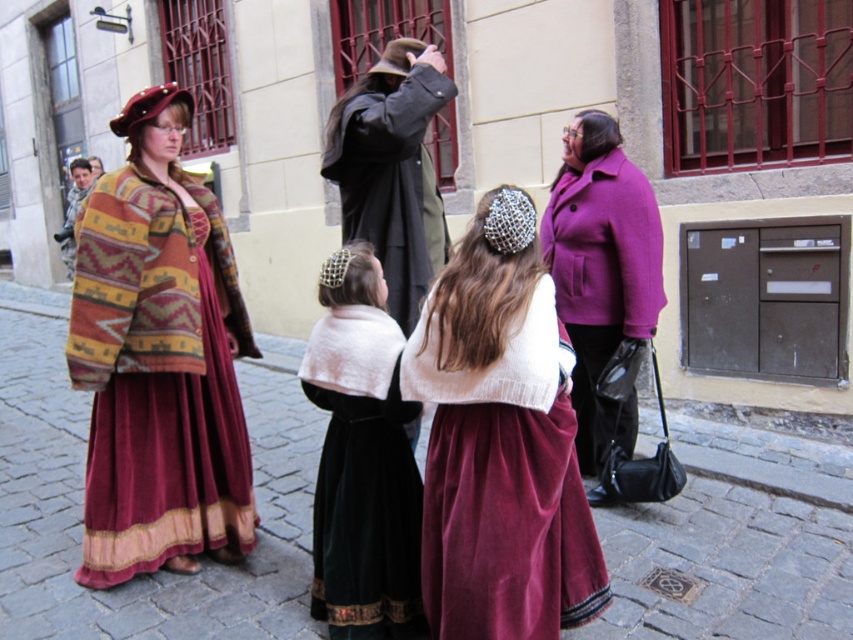
Does purple wool coat at upper right appear on the right side of purple woolen coat at right?

In fact, purple wool coat at upper right is to the left of purple woolen coat at right.

Does purple wool coat at upper right come behind purple woolen coat at right?

No, purple wool coat at upper right is closer to the viewer.

Find the location of a particular element. The height and width of the screenshot is (640, 853). purple wool coat at upper right is located at coordinates (602, 284).

You are a GUI agent. You are given a task and a screenshot of the screen. Output one action in this format:
    pyautogui.click(x=<x>, y=<y>)
    Task: Click on the purple wool coat at upper right
    
    Given the screenshot: What is the action you would take?
    pyautogui.click(x=602, y=284)

Does velvet black dress at center have a larger size compared to dark gray wool coat at center?

Correct, velvet black dress at center is larger in size than dark gray wool coat at center.

Does velvet black dress at center have a greater width compared to dark gray wool coat at center?

In fact, velvet black dress at center might be narrower than dark gray wool coat at center.

What do you see at coordinates (363, 458) in the screenshot? I see `velvet black dress at center` at bounding box center [363, 458].

This screenshot has width=853, height=640. I want to click on velvet black dress at center, so click(x=363, y=458).

Between point (527, 586) and point (585, 368), which one is positioned behind?

Positioned behind is point (585, 368).

Does velvet maroon skirt at center appear under purple wool coat at upper right?

Indeed, velvet maroon skirt at center is positioned under purple wool coat at upper right.

Describe the element at coordinates (500, 442) in the screenshot. I see `velvet maroon skirt at center` at that location.

You are a GUI agent. You are given a task and a screenshot of the screen. Output one action in this format:
    pyautogui.click(x=<x>, y=<y>)
    Task: Click on the velvet maroon skirt at center
    
    Given the screenshot: What is the action you would take?
    500,442